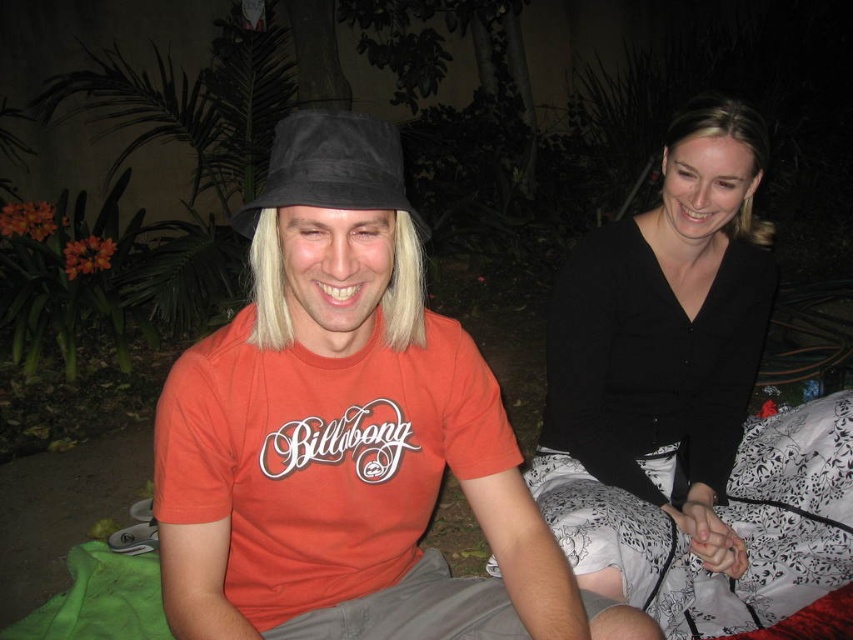
Question: Does matte black bucket hat at left have a greater width compared to black matte shirt at upper right?

Choices:
 (A) yes
 (B) no

Answer: (A)

Question: Is black matte shirt at upper right above black suede baseball hat at upper center?

Choices:
 (A) no
 (B) yes

Answer: (A)

Question: Can you confirm if black matte shirt at upper right is positioned to the right of white floral fabric at lower right?

Choices:
 (A) yes
 (B) no

Answer: (B)

Question: Which object is positioned closest to the matte black bucket hat at left?

Choices:
 (A) white floral fabric at lower right
 (B) black suede baseball hat at upper center
 (C) black matte shirt at upper right

Answer: (B)

Question: Among these objects, which one is nearest to the camera?

Choices:
 (A) black suede baseball hat at upper center
 (B) white floral fabric at lower right

Answer: (A)

Question: Which point is closer to the camera?

Choices:
 (A) black suede baseball hat at upper center
 (B) black matte shirt at upper right
 (C) matte black bucket hat at left
 (D) white floral fabric at lower right

Answer: (C)